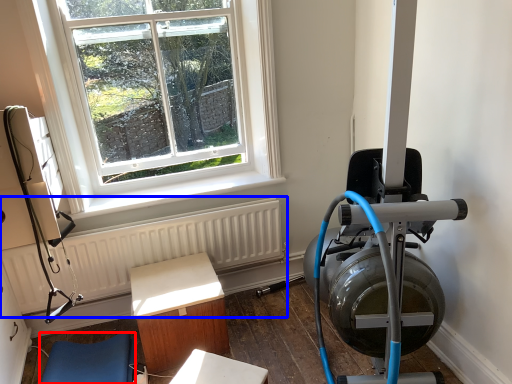
Question: Which of the following is the farthest to the observer, furniture (highlighted by a red box) or radiator (highlighted by a blue box)?

Choices:
 (A) furniture
 (B) radiator

Answer: (B)